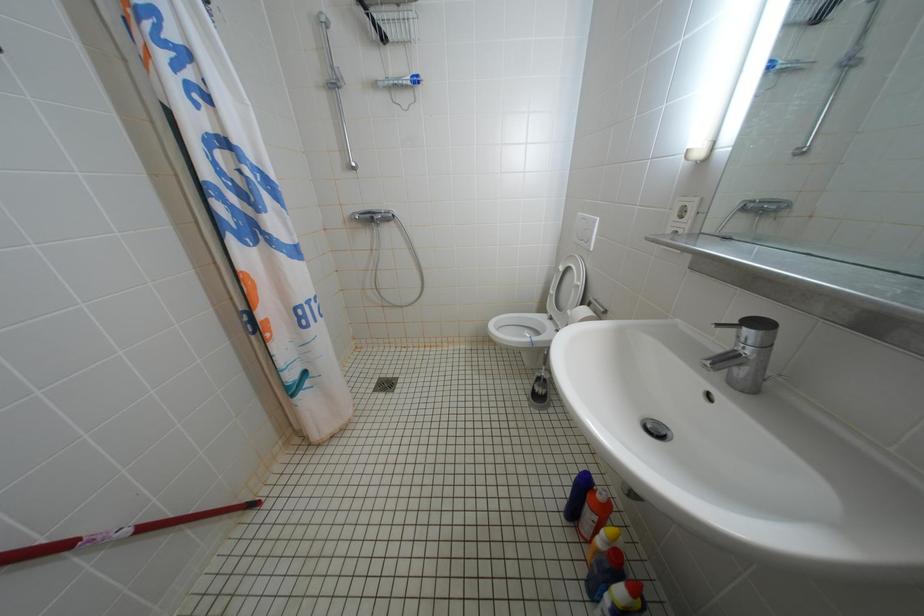
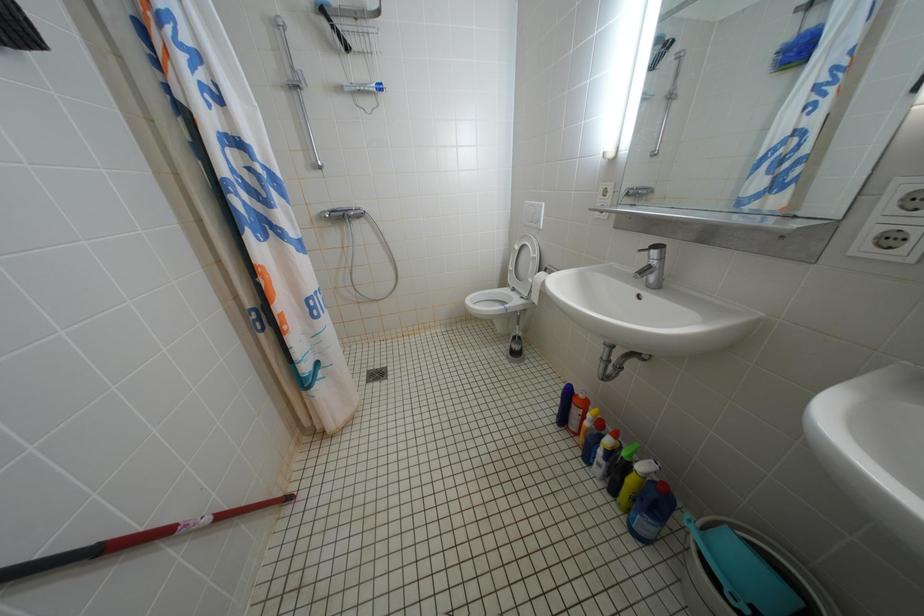
Which direction would the cameraman need to move to produce the second image?

The movement direction of the cameraman is left, backward.